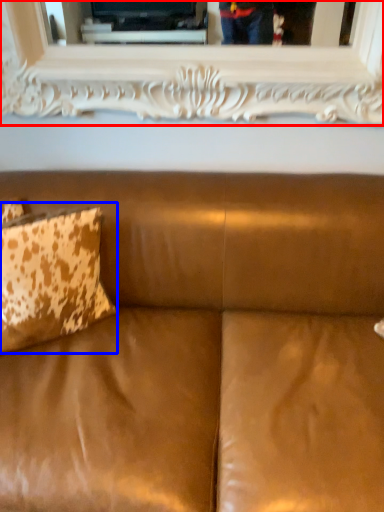
Question: Which object is closer to the camera taking this photo, picture frame (highlighted by a red box) or pillow (highlighted by a blue box)?

Choices:
 (A) picture frame
 (B) pillow

Answer: (B)